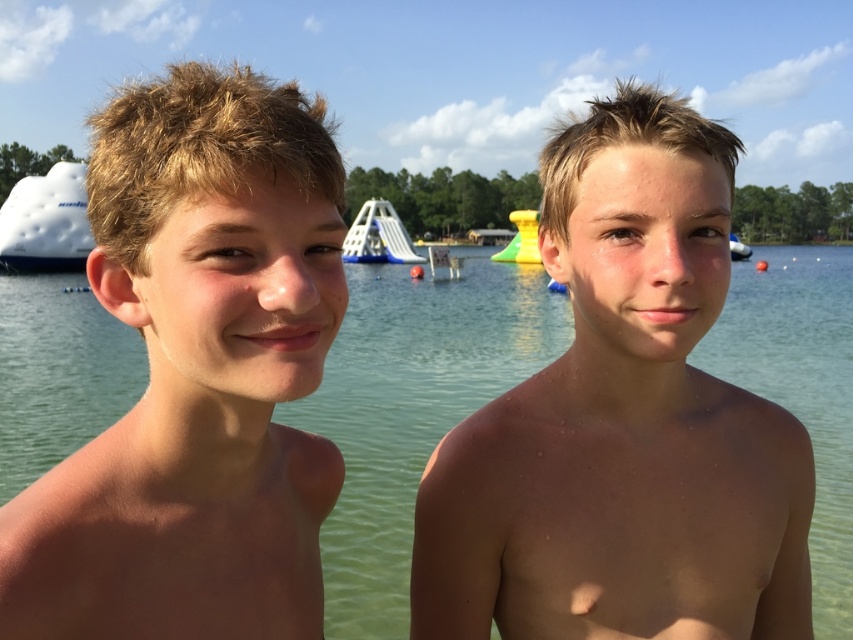
Can you confirm if clear water at center is shorter than white matte boat at left?

Yes, clear water at center is shorter than white matte boat at left.

Which is behind, point (74, 308) or point (54, 225)?

Point (54, 225)

Is point (424, 278) less distant than point (27, 228)?

Yes, point (424, 278) is closer to viewer.

I want to click on clear water at center, so click(410, 410).

Between point (286, 106) and point (734, 257), which one is positioned behind?

The point (734, 257) is behind.

Between golden hair at center and white glossy boat at upper center, which one has less height?

With less height is golden hair at center.

Where is `golden hair at center`? This screenshot has width=853, height=640. golden hair at center is located at coordinates (196, 374).

From the picture: Is dry skin boy at center positioned before white plastic slide at center?

Yes, it is.

At what (x,y) coordinates should I click in order to perform the action: click on dry skin boy at center. Please return your answer as a coordinate pair (x, y). Looking at the image, I should click on (624, 422).